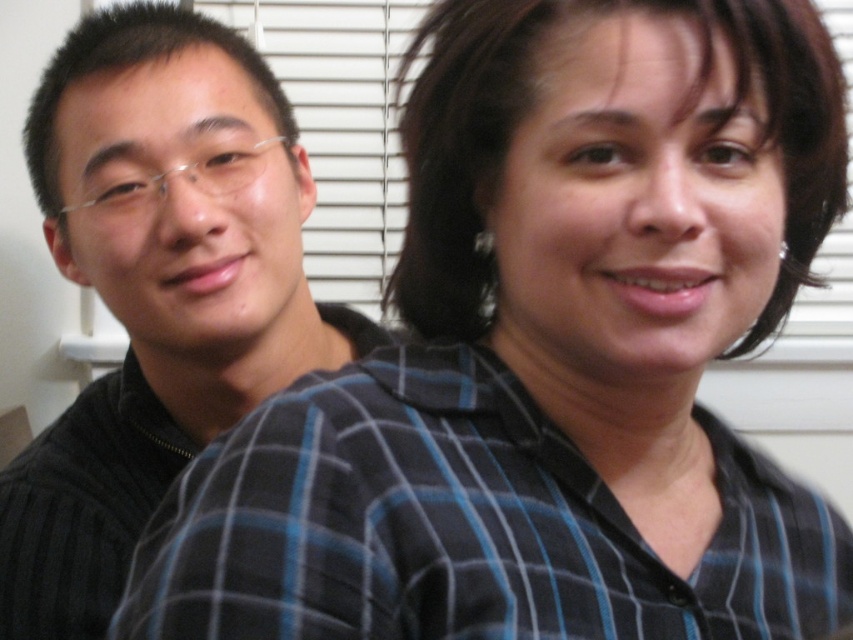
Question: Which of the following is the farthest from the observer?

Choices:
 (A) (86, 637)
 (B) (428, 380)

Answer: (A)

Question: Does blue plaid shirt at center have a lesser width compared to matte black sweater at left?

Choices:
 (A) no
 (B) yes

Answer: (A)

Question: Which point appears farthest from the camera in this image?

Choices:
 (A) (659, 614)
 (B) (173, 461)

Answer: (B)

Question: Can you confirm if blue plaid shirt at center is bigger than matte black sweater at left?

Choices:
 (A) no
 (B) yes

Answer: (A)

Question: Among these points, which one is farthest from the camera?

Choices:
 (A) (120, 157)
 (B) (469, 522)

Answer: (A)

Question: Can you confirm if blue plaid shirt at center is positioned above matte black sweater at left?

Choices:
 (A) yes
 (B) no

Answer: (B)